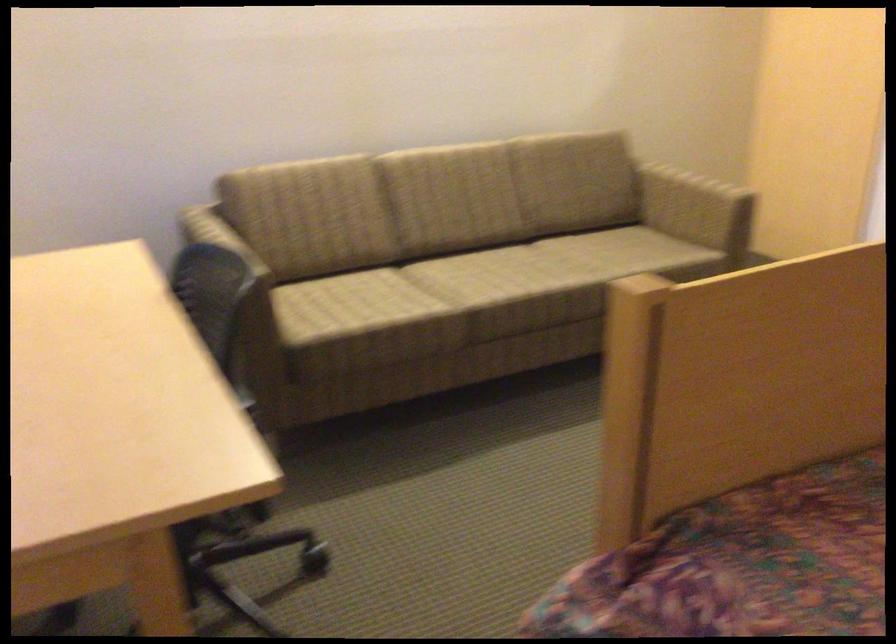
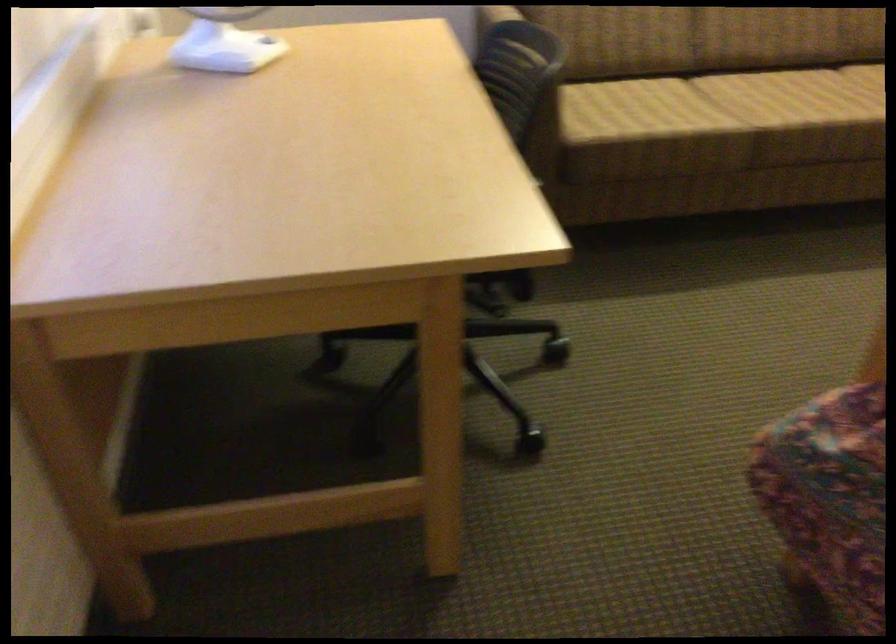
Question: The camera is either moving clockwise (left) or counter-clockwise (right) around the object. The first image is from the beginning of the video and the second image is from the end. Is the camera moving left or right when shooting the video?

Choices:
 (A) Left
 (B) Right

Answer: (B)